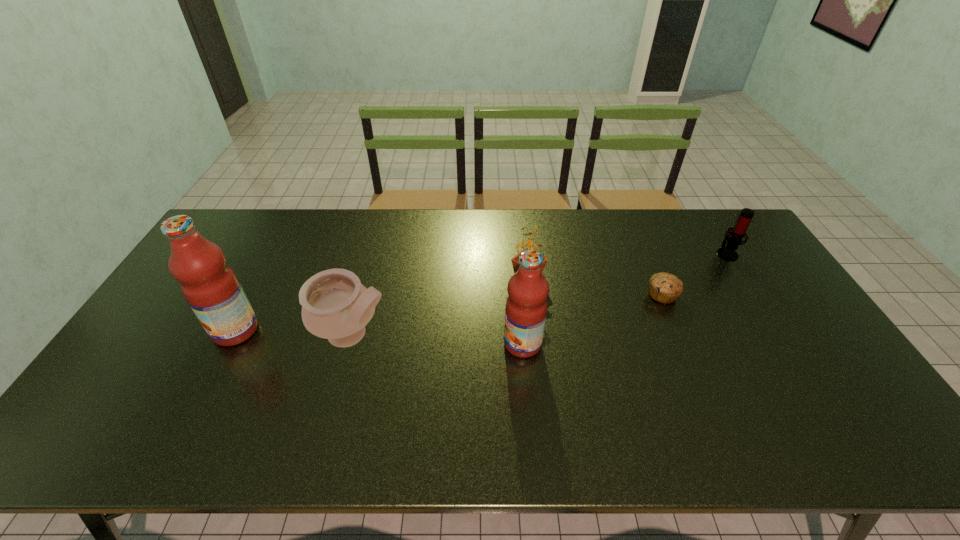
What are the coordinates of `free spot between the taller fruit juice and the sunflower` in the screenshot? It's located at (382, 305).

At what (x,y) coordinates should I click in order to perform the action: click on free space between the sunflower and the fifth object from left to right. Please return your answer as a coordinate pair (x, y). Looking at the image, I should click on (595, 287).

Where is `free space between the right fruit juice and the second object from left to right`? The height and width of the screenshot is (540, 960). free space between the right fruit juice and the second object from left to right is located at coordinates (438, 339).

Locate an element on the screen. empty space that is in between the muffin and the sunflower is located at coordinates (595, 287).

Identify the location of vacant space in between the farthest object and the sunflower. The height and width of the screenshot is (540, 960). (627, 266).

At what (x,y) coordinates should I click in order to perform the action: click on object that is the nearest to the rightmost object. Please return your answer as a coordinate pair (x, y). The height and width of the screenshot is (540, 960). Looking at the image, I should click on (664, 287).

Locate which object is the fourth closest to the fifth object from left to right. Please provide its 2D coordinates. Your answer should be formatted as a tuple, i.e. [(x, y)], where the tuple contains the x and y coordinates of a point satisfying the conditions above.

[(335, 305)]

Image resolution: width=960 pixels, height=540 pixels. In order to click on vacant space that satisfies the following two spatial constraints: 1. on the front label of the leftmost object; 2. on the back side of the fifth object from right to left in this screenshot , I will do `click(233, 335)`.

In order to click on vacant space that satisfies the following two spatial constraints: 1. on the back side of the pottery; 2. on the front label of the left fruit juice in this screenshot , I will do `click(354, 330)`.

Locate an element on the screen. free space that satisfies the following two spatial constraints: 1. at the front of the muffin with flowers visible; 2. on the right side of the sunflower is located at coordinates (530, 295).